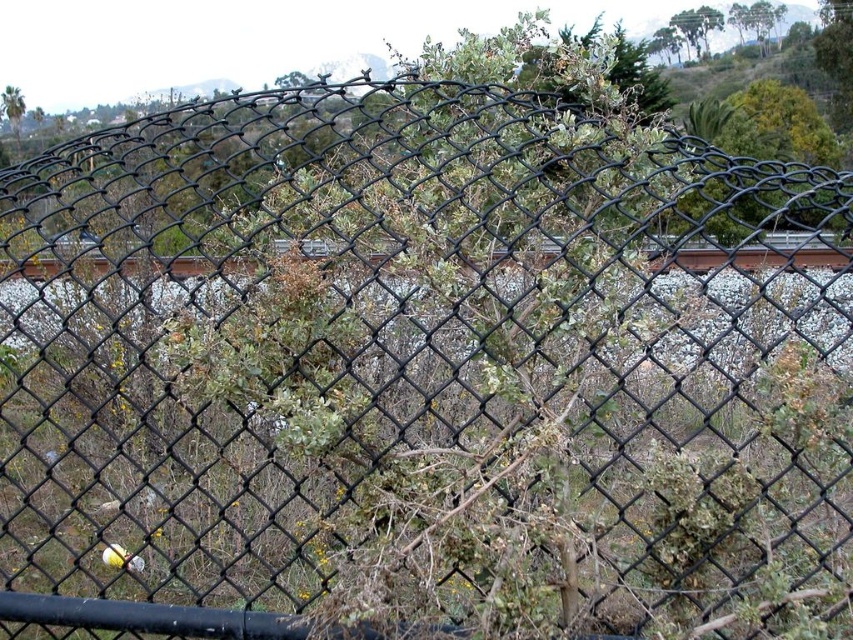
You are standing at the point of origin in the image and want to place a new brown wooden train track at center. Where should you place it?

The brown wooden train track at center should be placed at point (119, 266).

You are standing 1.5 meters away from the brown wooden train track at center. Can you reach it without moving your feet?

The brown wooden train track at center is 1.27 meters away from the viewer. Since you are standing 1.5 meters away, you are actually farther than the track, so you cannot reach it without moving closer.